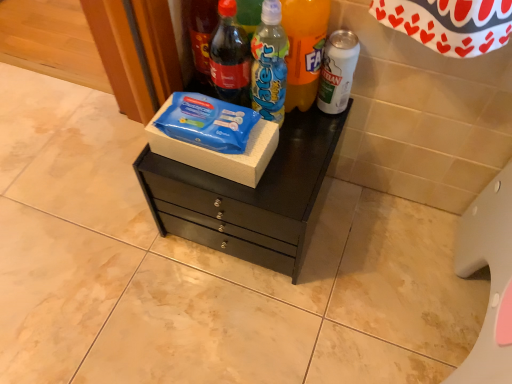
Question: Considering the positions of point (243, 236) and point (344, 99), is point (243, 236) closer or farther from the camera than point (344, 99)?

Choices:
 (A) farther
 (B) closer

Answer: (A)

Question: From a real-world perspective, is black matte chest of drawers at center positioned above or below white matte can at right, which is the fifth bottle from left to right?

Choices:
 (A) below
 (B) above

Answer: (A)

Question: Considering the real-world distances, which object is farthest from the matte glass soda bottle at upper left, the first bottle in the left-to-right sequence?

Choices:
 (A) white matte can at right, which is the fifth bottle from left to right
 (B) black matte chest of drawers at center
 (C) blue plastic bottle at center, positioned as the third bottle in right-to-left order
 (D) translucent plastic water bottle at center, which ranks as the fourth bottle in left-to-right order
 (E) matte glass soda bottle at upper center, which ranks as the fourth bottle in right-to-left order

Answer: (B)

Question: Which object is positioned farthest from the matte glass soda bottle at upper left, which is the 5th bottle in right-to-left order?

Choices:
 (A) white matte can at right, which is the fifth bottle from left to right
 (B) black matte chest of drawers at center
 (C) blue plastic bottle at center, positioned as the third bottle in right-to-left order
 (D) matte glass soda bottle at upper center, which ranks as the fourth bottle in right-to-left order
 (E) blue plastic lunch box at center

Answer: (B)